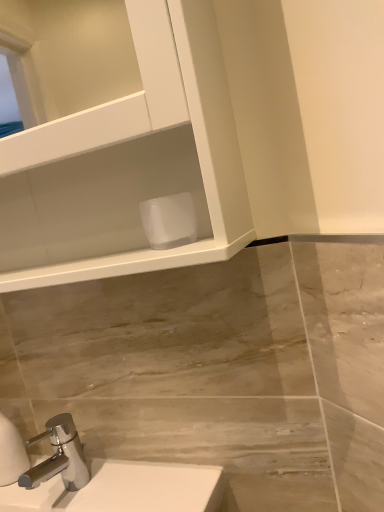
Image resolution: width=384 pixels, height=512 pixels. Describe the element at coordinates (169, 221) in the screenshot. I see `white matte toilet paper at lower center` at that location.

Where is `white matte toilet paper at lower center`? The height and width of the screenshot is (512, 384). white matte toilet paper at lower center is located at coordinates (169, 221).

The height and width of the screenshot is (512, 384). I want to click on chrome metallic faucet at lower left, so click(x=59, y=456).

This screenshot has width=384, height=512. What do you see at coordinates (59, 456) in the screenshot?
I see `chrome metallic faucet at lower left` at bounding box center [59, 456].

Where is `white matte toilet paper at lower center`? Image resolution: width=384 pixels, height=512 pixels. white matte toilet paper at lower center is located at coordinates (169, 221).

Considering the relative positions of chrome metallic faucet at lower left and white matte toilet paper at lower center in the image provided, is chrome metallic faucet at lower left to the left of white matte toilet paper at lower center from the viewer's perspective?

Indeed, chrome metallic faucet at lower left is positioned on the left side of white matte toilet paper at lower center.

Which is in front, chrome metallic faucet at lower left or white matte toilet paper at lower center?

Positioned in front is white matte toilet paper at lower center.

Which is in front, point (70, 488) or point (146, 229)?

The point (146, 229) is in front.

From the image's perspective, would you say chrome metallic faucet at lower left is shown under white matte toilet paper at lower center?

Correct, chrome metallic faucet at lower left appears lower than white matte toilet paper at lower center in the image.

From a real-world perspective, which object stands above the other?

In real-world perspective, white matte toilet paper at lower center is above.

Considering the relative sizes of chrome metallic faucet at lower left and white matte toilet paper at lower center in the image provided, is chrome metallic faucet at lower left wider than white matte toilet paper at lower center?

Yes.

Between chrome metallic faucet at lower left and white matte toilet paper at lower center, which one has more height?

Standing taller between the two is chrome metallic faucet at lower left.

Is chrome metallic faucet at lower left bigger than white matte toilet paper at lower center?

Indeed, chrome metallic faucet at lower left has a larger size compared to white matte toilet paper at lower center.

Would you say chrome metallic faucet at lower left is outside white matte toilet paper at lower center?

Yes, chrome metallic faucet at lower left is not within white matte toilet paper at lower center.

Would you consider chrome metallic faucet at lower left to be distant from white matte toilet paper at lower center?

No, there isn't a large distance between chrome metallic faucet at lower left and white matte toilet paper at lower center.

Is white matte toilet paper at lower center at the back of chrome metallic faucet at lower left?

No, chrome metallic faucet at lower left is not facing away from white matte toilet paper at lower center.

At what (x,y) coordinates should I click in order to perform the action: click on toilet paper positioned vertically above the chrome metallic faucet at lower left (from a real-world perspective). Please return your answer as a coordinate pair (x, y). Image resolution: width=384 pixels, height=512 pixels. Looking at the image, I should click on (169, 221).

Is white matte toilet paper at lower center to the left of chrome metallic faucet at lower left from the viewer's perspective?

No.

Considering the relative positions of white matte toilet paper at lower center and chrome metallic faucet at lower left in the image provided, is white matte toilet paper at lower center behind chrome metallic faucet at lower left?

No, white matte toilet paper at lower center is closer to the viewer.

Considering the positions of points (157, 201) and (49, 458), is point (157, 201) farther from camera compared to point (49, 458)?

No, it is in front of (49, 458).

From the image's perspective, which one is positioned lower, white matte toilet paper at lower center or chrome metallic faucet at lower left?

chrome metallic faucet at lower left appears lower in the image.

From a real-world perspective, which is physically above, white matte toilet paper at lower center or chrome metallic faucet at lower left?

In real-world perspective, white matte toilet paper at lower center is above.

Is white matte toilet paper at lower center wider or thinner than chrome metallic faucet at lower left?

In the image, white matte toilet paper at lower center appears to be more narrow than chrome metallic faucet at lower left.

Between white matte toilet paper at lower center and chrome metallic faucet at lower left, which one has more height?

chrome metallic faucet at lower left.

Between white matte toilet paper at lower center and chrome metallic faucet at lower left, which one has larger size?

With larger size is chrome metallic faucet at lower left.

Is chrome metallic faucet at lower left surrounded by white matte toilet paper at lower center?

No, chrome metallic faucet at lower left is located outside of white matte toilet paper at lower center.

Is white matte toilet paper at lower center directly adjacent to chrome metallic faucet at lower left?

No, white matte toilet paper at lower center is not in contact with chrome metallic faucet at lower left.

Is white matte toilet paper at lower center turned away from chrome metallic faucet at lower left?

white matte toilet paper at lower center is not turned away from chrome metallic faucet at lower left.

How many degrees apart are the facing directions of white matte toilet paper at lower center and chrome metallic faucet at lower left?

The angular difference between white matte toilet paper at lower center and chrome metallic faucet at lower left is 1.19 degrees.

The image size is (384, 512). In order to click on toilet paper that is above the chrome metallic faucet at lower left (from the image's perspective) in this screenshot , I will do `click(169, 221)`.

The image size is (384, 512). What are the coordinates of `tap below the white matte toilet paper at lower center (from a real-world perspective)` in the screenshot? It's located at (59, 456).

Find the location of `tap below the white matte toilet paper at lower center (from the image's perspective)`. tap below the white matte toilet paper at lower center (from the image's perspective) is located at coordinates (59, 456).